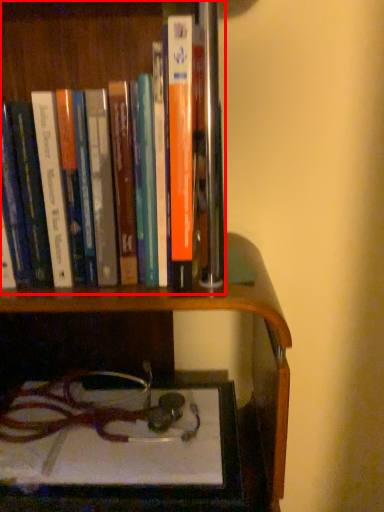
Question: From the image's perspective, considering the relative positions of book (annotated by the red box) and shelf in the image provided, where is book (annotated by the red box) located with respect to the staircase?

Choices:
 (A) above
 (B) below

Answer: (A)